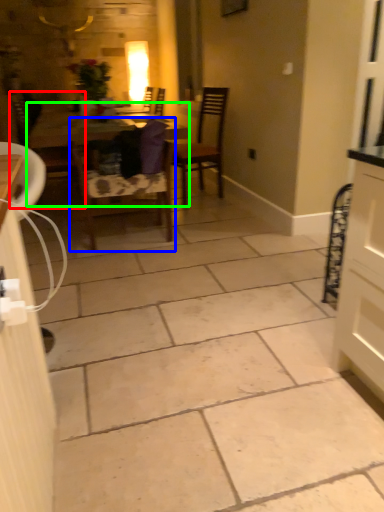
Question: Estimate the real-world distances between objects in this image. Which object is closer to chair (highlighted by a red box), chair (highlighted by a blue box) or table (highlighted by a green box)?

Choices:
 (A) chair
 (B) table

Answer: (B)